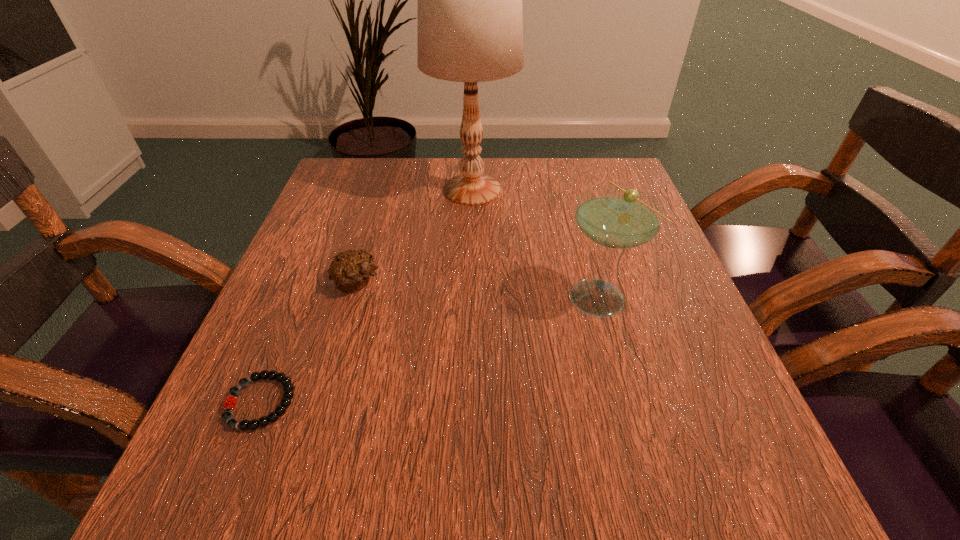
This screenshot has width=960, height=540. Identify the location of vacant space at the near right corner of the desktop. (692, 476).

At what (x,y) coordinates should I click in order to perform the action: click on empty location between the second shortest object and the shortest object. Please return your answer as a coordinate pair (x, y). Looking at the image, I should click on (309, 342).

Locate an element on the screen. This screenshot has height=540, width=960. free spot between the muffin and the second object from right to left is located at coordinates (415, 237).

The image size is (960, 540). What are the coordinates of `free space that is in between the nearest object and the tallest object` in the screenshot? It's located at (367, 296).

You are a GUI agent. You are given a task and a screenshot of the screen. Output one action in this format:
    pyautogui.click(x=<x>, y=<y>)
    Task: Click on the blank region between the lamp and the rightmost object
    
    Given the screenshot: What is the action you would take?
    pos(536,243)

Image resolution: width=960 pixels, height=540 pixels. In order to click on vacant space that is in between the shortest object and the third object from left to right in this screenshot , I will do `click(367, 296)`.

This screenshot has width=960, height=540. What are the coordinates of `free point between the muffin and the rightmost object` in the screenshot? It's located at (478, 289).

The height and width of the screenshot is (540, 960). I want to click on free spot between the tallest object and the second shortest object, so click(x=415, y=237).

This screenshot has height=540, width=960. In order to click on vacant area between the lamp and the second tallest object in this screenshot , I will do [x=536, y=243].

This screenshot has height=540, width=960. In order to click on free space between the tallest object and the muffin in this screenshot , I will do `click(415, 237)`.